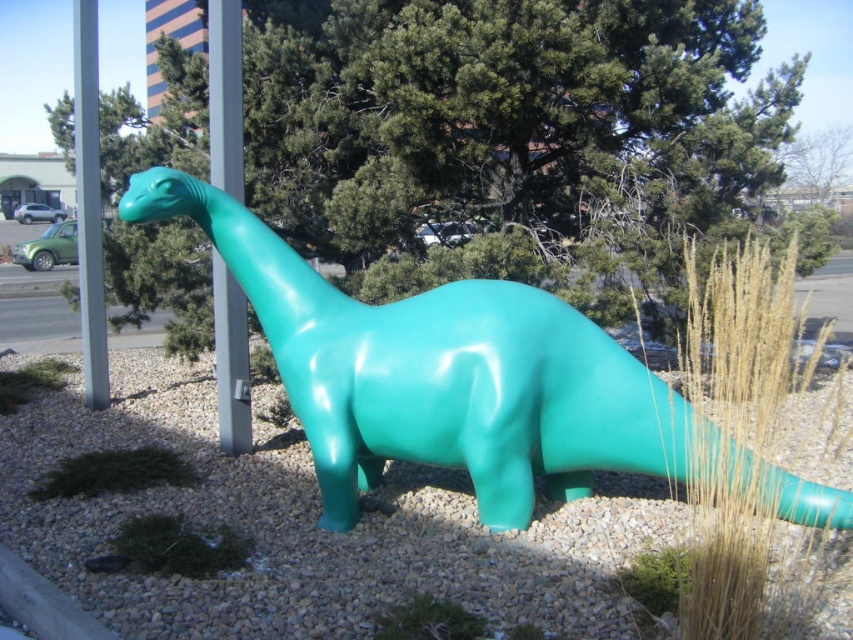
You are a city planner reviewing a public space design. The green glossy dinosaur at center and the metallic gray pole at upper center are part of the proposed installation. Based on the scene, which object is shorter?

The green glossy dinosaur at center is shorter than the metallic gray pole at upper center.

You are standing at the center of a park and see the glossy plastic dinosaur at center. If you walk straight ahead, will you reach the dinosaur before the trees in the background?

Yes, because the glossy plastic dinosaur at center is located between you and the trees in the background, so you would reach it first.